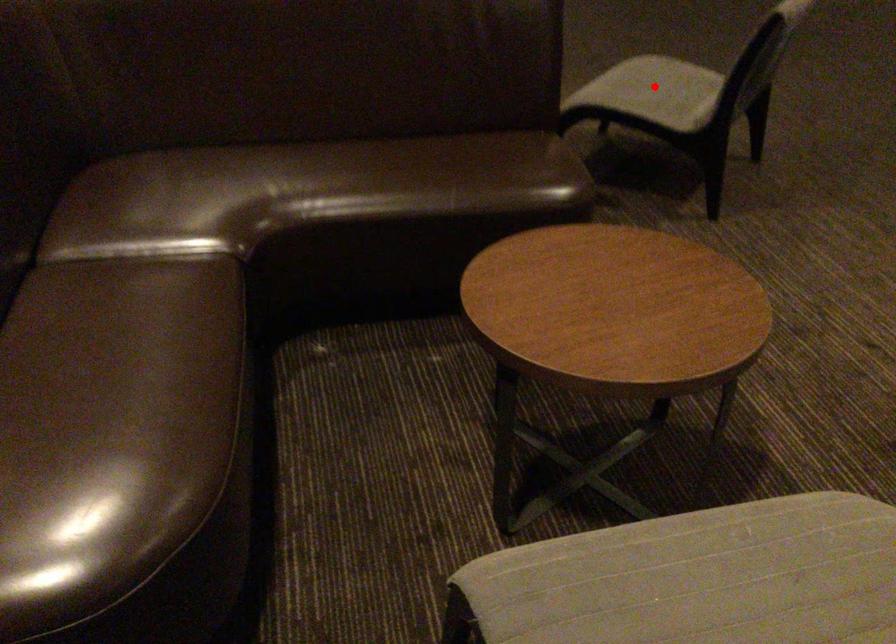
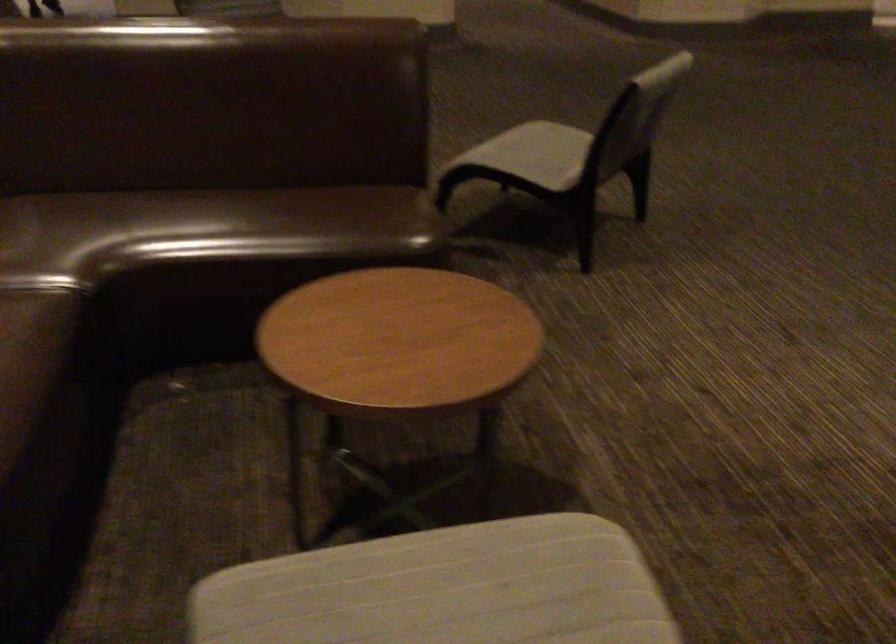
Locate, in the second image, the point that corresponds to the highlighted location in the first image.

(533, 154)